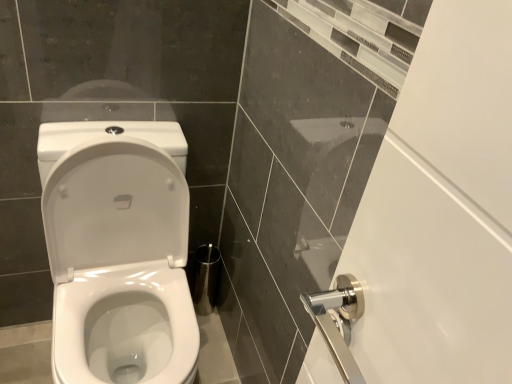
What do you see at coordinates (118, 251) in the screenshot? I see `white glossy toilet at left` at bounding box center [118, 251].

Find the location of a particular element. The height and width of the screenshot is (384, 512). white glossy toilet at left is located at coordinates (118, 251).

Locate an element on the screen. This screenshot has width=512, height=384. white glossy toilet at left is located at coordinates (118, 251).